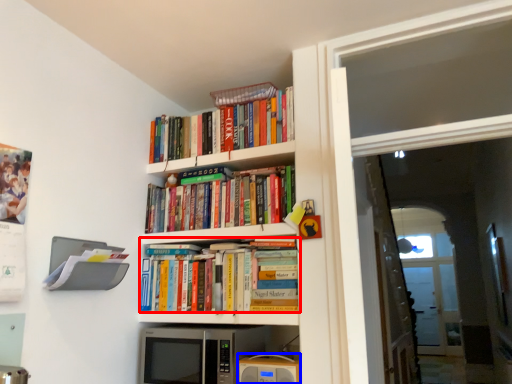
Question: Which point is closer to the camera, book (highlighted by a red box) or appliance (highlighted by a blue box)?

Choices:
 (A) book
 (B) appliance

Answer: (B)